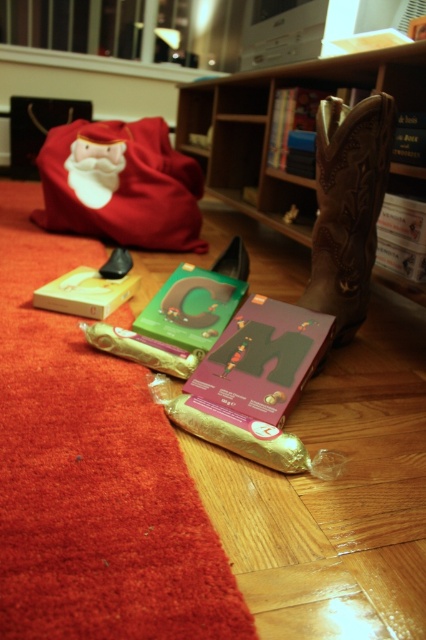
Which is above, red fabric santa bag at upper left or green matte book at center?

Positioned higher is red fabric santa bag at upper left.

How distant is red fabric santa bag at upper left from green matte book at center?

They are 83.44 centimeters apart.

Who is more forward, [184,182] or [192,284]?

Point [192,284] is more forward.

You are a GUI agent. You are given a task and a screenshot of the screen. Output one action in this format:
    pyautogui.click(x=<x>, y=<y>)
    Task: Click on the red fabric santa bag at upper left
    The height and width of the screenshot is (640, 426).
    Given the screenshot: What is the action you would take?
    pyautogui.click(x=120, y=184)

Can you confirm if green matte book at center is shorter than matte yellow book at lower left?

Incorrect, green matte book at center's height does not fall short of matte yellow book at lower left's.

From the picture: How far apart are green matte book at center and matte yellow book at lower left?

They are 22.12 centimeters apart.

Is point (181, 268) behind point (36, 292)?

Yes, it is.

At what (x,y) coordinates should I click in order to perform the action: click on green matte book at center. Please return your answer as a coordinate pair (x, y). The width and height of the screenshot is (426, 640). Looking at the image, I should click on (190, 308).

Between point (363, 195) and point (218, 371), which one is positioned in front?

Point (218, 371) is more forward.

Which is more to the right, brown leather cowboy boot at right or matte purple cardboard letter m at center?

brown leather cowboy boot at right is more to the right.

Is point (365, 189) closer to camera compared to point (218, 404)?

No, it is behind (218, 404).

Where is `brown leather cowboy boot at right`? brown leather cowboy boot at right is located at coordinates (348, 205).